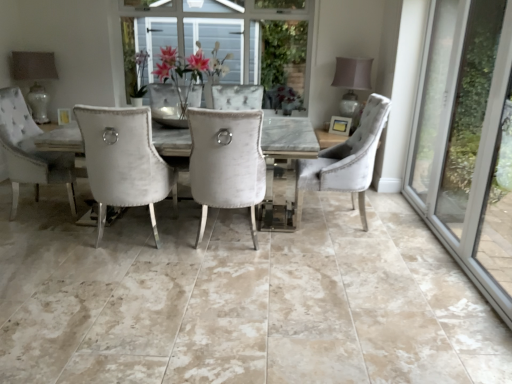
Question: Does matte glass lampshade at upper left, which is the second lamp in right-to-left order, have a lesser height compared to velvet white chair at center, marked as the 2th chair in a right-to-left arrangement?

Choices:
 (A) yes
 (B) no

Answer: (A)

Question: Is matte glass lampshade at upper left, arranged as the 1th lamp when viewed from the left, positioned with its back to velvet white chair at center, which ranks as the first chair in left-to-right order?

Choices:
 (A) no
 (B) yes

Answer: (A)

Question: From a real-world perspective, is matte glass lampshade at upper left, arranged as the 1th lamp when viewed from the left, on top of velvet white chair at center, marked as the 2th chair in a right-to-left arrangement?

Choices:
 (A) no
 (B) yes

Answer: (B)

Question: Considering the relative sizes of matte glass lampshade at upper left, arranged as the 1th lamp when viewed from the left, and velvet white chair at center, which ranks as the first chair in left-to-right order, in the image provided, is matte glass lampshade at upper left, arranged as the 1th lamp when viewed from the left, taller than velvet white chair at center, which ranks as the first chair in left-to-right order,?

Choices:
 (A) no
 (B) yes

Answer: (A)

Question: From a real-world perspective, is matte glass lampshade at upper left, which is the second lamp in right-to-left order, positioned under velvet white chair at center, marked as the 2th chair in a right-to-left arrangement, based on gravity?

Choices:
 (A) yes
 (B) no

Answer: (B)

Question: Is velvet white chair at center, which ranks as the first chair in left-to-right order, bigger or smaller than matte white vase at upper center?

Choices:
 (A) big
 (B) small

Answer: (A)

Question: In the image, is velvet white chair at center, marked as the 2th chair in a right-to-left arrangement, positioned in front of or behind matte white vase at upper center?

Choices:
 (A) front
 (B) behind

Answer: (A)

Question: From a real-world perspective, is velvet white chair at center, marked as the 2th chair in a right-to-left arrangement, positioned above or below matte white vase at upper center?

Choices:
 (A) below
 (B) above

Answer: (A)

Question: In terms of height, does velvet white chair at center, marked as the 2th chair in a right-to-left arrangement, look taller or shorter compared to matte white vase at upper center?

Choices:
 (A) tall
 (B) short

Answer: (A)

Question: From a real-world perspective, is velvet grey chair at right, the second chair in the left-to-right sequence, physically located above or below matte white vase at upper center?

Choices:
 (A) below
 (B) above

Answer: (A)

Question: Is velvet grey chair at right, which ranks as the first chair in right-to-left order, to the left or to the right of matte white vase at upper center in the image?

Choices:
 (A) left
 (B) right

Answer: (B)

Question: From the image's perspective, is velvet grey chair at right, the second chair in the left-to-right sequence, located above or below matte white vase at upper center?

Choices:
 (A) below
 (B) above

Answer: (A)

Question: Relative to matte white vase at upper center, is velvet grey chair at right, the second chair in the left-to-right sequence, in front or behind?

Choices:
 (A) front
 (B) behind

Answer: (A)

Question: From a real-world perspective, relative to matte glass lampshade at upper left, which is the second lamp in right-to-left order, is velvet grey chair at right, the second chair in the left-to-right sequence, vertically above or below?

Choices:
 (A) below
 (B) above

Answer: (A)

Question: Is velvet grey chair at right, the second chair in the left-to-right sequence, in front of or behind matte glass lampshade at upper left, which is the second lamp in right-to-left order, in the image?

Choices:
 (A) front
 (B) behind

Answer: (A)